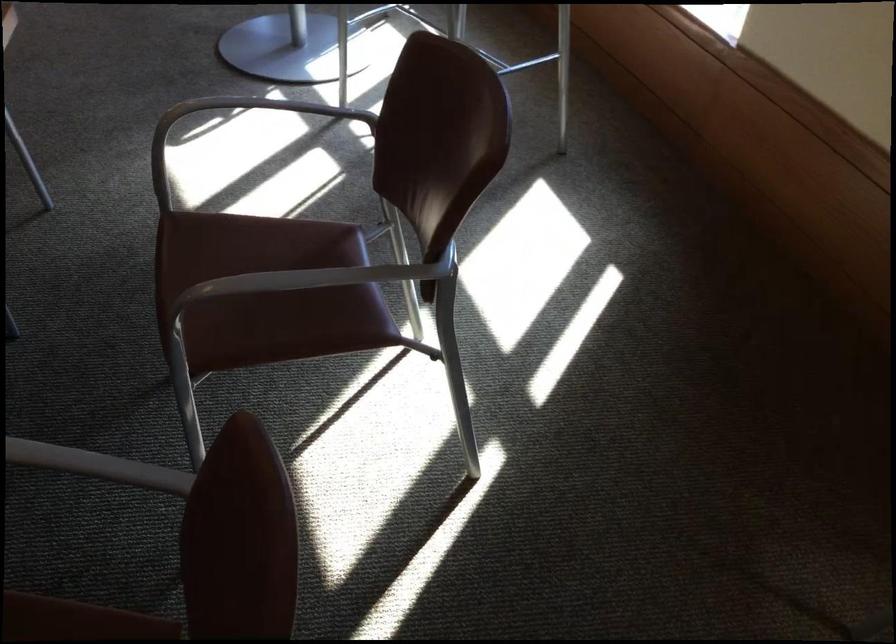
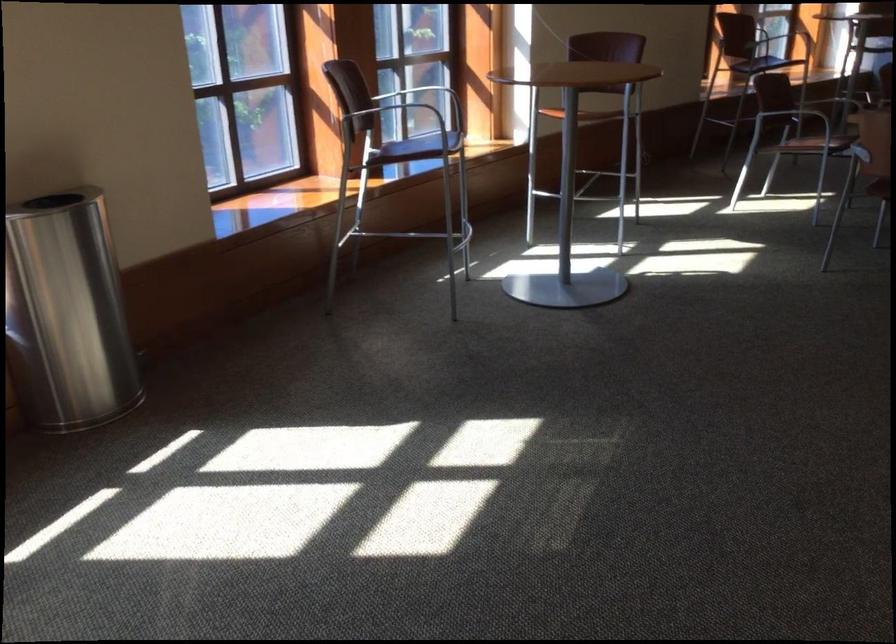
Question: I am providing you with two images of the same scene from different viewpoints. Which of the following objects are not visible in image2?

Choices:
 (A) silver trash can
 (B) metal shower door handle
 (C) metal chair armrest
 (D) chair sitting surface

Answer: (C)